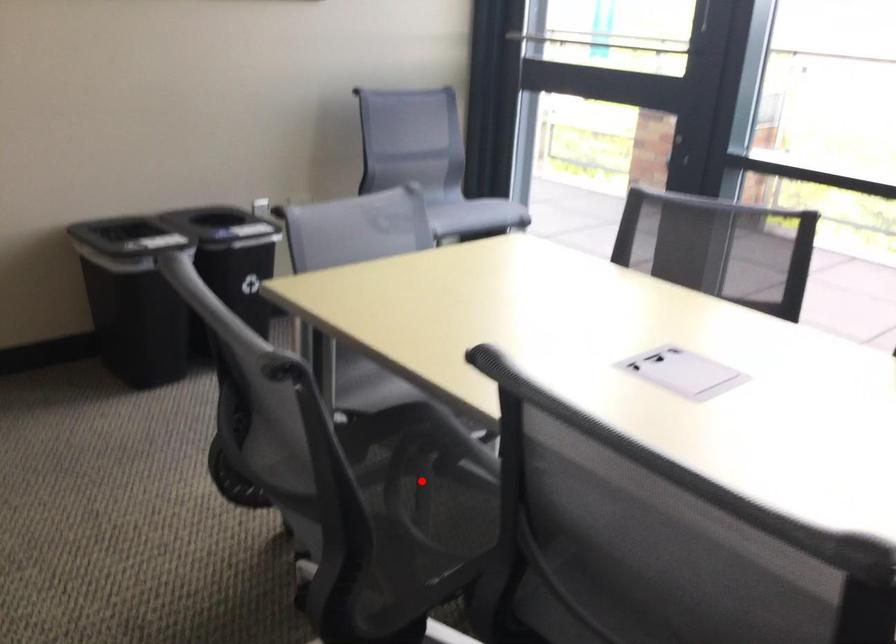
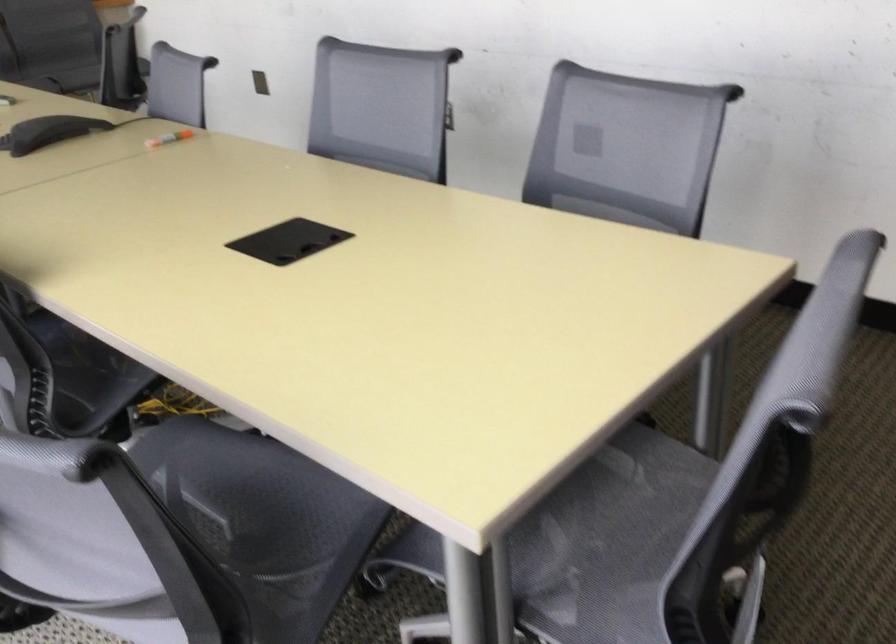
Question: I am providing you with two images of the same scene from different viewpoints. A red point is marked on the first image. Can you still see the location of the red point in image 2?

Choices:
 (A) Yes
 (B) No

Answer: (B)